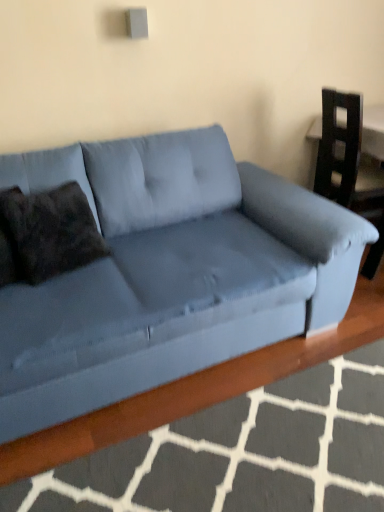
Question: Does matte blue armchair at right lie behind velvet blue couch at center?

Choices:
 (A) no
 (B) yes

Answer: (B)

Question: Does matte blue armchair at right have a lesser width compared to velvet blue couch at center?

Choices:
 (A) no
 (B) yes

Answer: (B)

Question: Does matte blue armchair at right have a larger size compared to velvet blue couch at center?

Choices:
 (A) yes
 (B) no

Answer: (B)

Question: Does matte blue armchair at right appear on the right side of velvet blue couch at center?

Choices:
 (A) yes
 (B) no

Answer: (A)

Question: From the image's perspective, is matte blue armchair at right over velvet blue couch at center?

Choices:
 (A) no
 (B) yes

Answer: (B)

Question: Is matte blue armchair at right with velvet blue couch at center?

Choices:
 (A) no
 (B) yes

Answer: (A)

Question: Does dark brown textured pillow at left turn towards matte blue armchair at right?

Choices:
 (A) yes
 (B) no

Answer: (B)

Question: Is dark brown textured pillow at left thinner than matte blue armchair at right?

Choices:
 (A) yes
 (B) no

Answer: (A)

Question: Would you say dark brown textured pillow at left is a long distance from matte blue armchair at right?

Choices:
 (A) yes
 (B) no

Answer: (A)

Question: Can you confirm if dark brown textured pillow at left is positioned to the right of matte blue armchair at right?

Choices:
 (A) no
 (B) yes

Answer: (A)

Question: Is the position of dark brown textured pillow at left more distant than that of matte blue armchair at right?

Choices:
 (A) yes
 (B) no

Answer: (B)

Question: Considering the relative sizes of dark brown textured pillow at left and matte blue armchair at right in the image provided, is dark brown textured pillow at left shorter than matte blue armchair at right?

Choices:
 (A) no
 (B) yes

Answer: (B)

Question: Considering the relative sizes of velvet blue couch at center and dark brown textured pillow at left in the image provided, is velvet blue couch at center shorter than dark brown textured pillow at left?

Choices:
 (A) yes
 (B) no

Answer: (B)